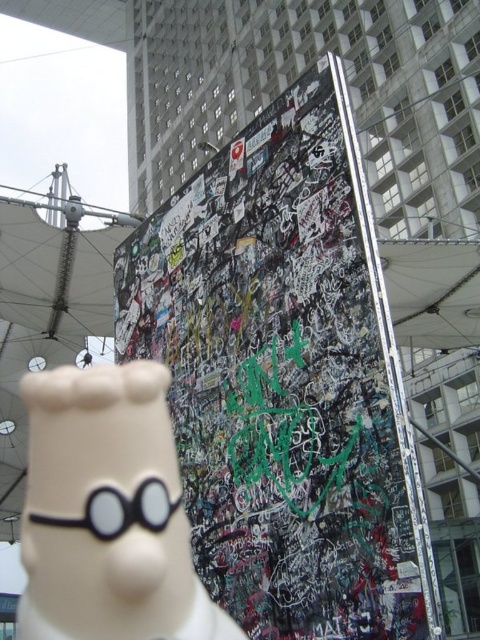
Question: Is white matte figurine at center to the right of white fabric canopy at upper left from the viewer's perspective?

Choices:
 (A) yes
 (B) no

Answer: (A)

Question: Among these objects, which one is nearest to the camera?

Choices:
 (A) white fabric canopy at upper left
 (B) white matte figurine at center

Answer: (B)

Question: Where is white matte figurine at center located in relation to white fabric canopy at upper left in the image?

Choices:
 (A) below
 (B) above

Answer: (A)

Question: Where is white matte figurine at center located in relation to white fabric canopy at upper left in the image?

Choices:
 (A) right
 (B) left

Answer: (A)

Question: Among these objects, which one is nearest to the camera?

Choices:
 (A) white matte figurine at center
 (B) white fabric canopy at upper left

Answer: (A)